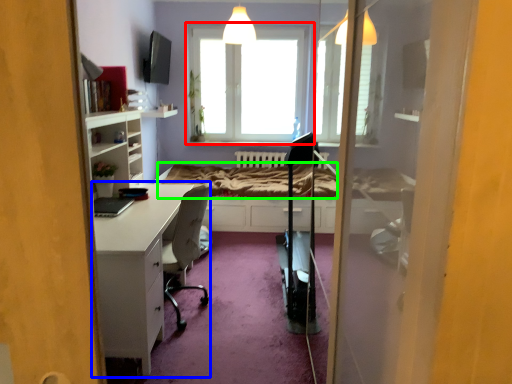
Question: Estimate the real-world distances between objects in this image. Which object is closer to window (highlighted by a red box), desk (highlighted by a blue box) or bed frame (highlighted by a green box)?

Choices:
 (A) desk
 (B) bed frame

Answer: (B)